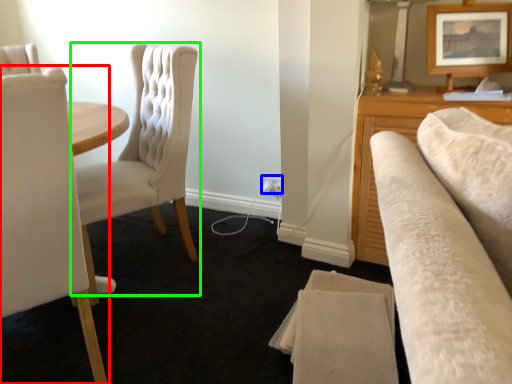
Question: Which object is positioned closest to chair (highlighted by a red box)? Select from electric outlet (highlighted by a blue box) and chair (highlighted by a green box).

Choices:
 (A) electric outlet
 (B) chair

Answer: (B)